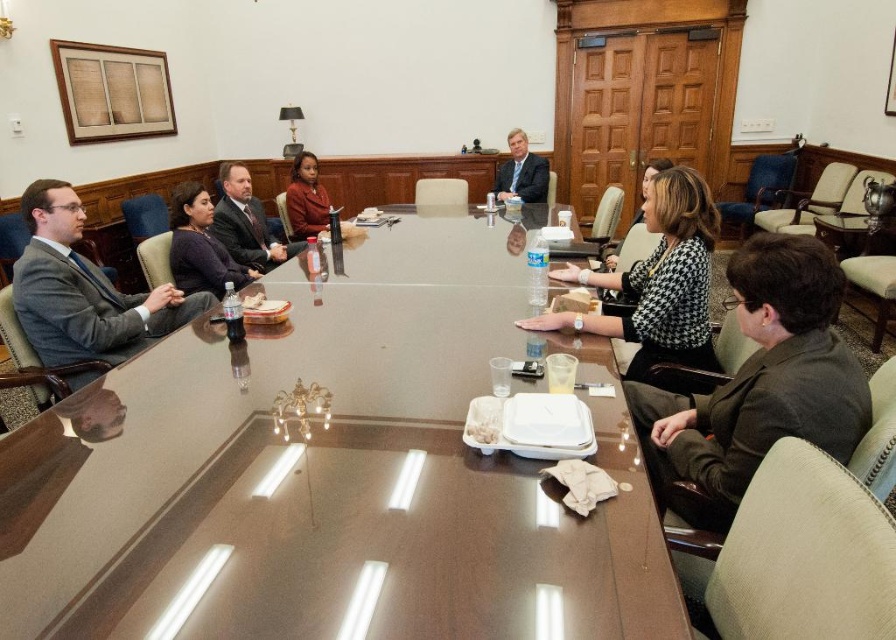
You are a photographer in the conference room. You need to capture a photo of the black houndstooth dress at center and the matte black suit at upper center. Which one will appear larger in the photo?

The black houndstooth dress at center is much taller than the matte black suit at upper center, so it will appear larger in the photo.

You are a photographer taking a picture of the conference table. You need to place a small decorative item exactly halfway between the point at coordinate point (145,323) and the point at coordinate point (306,188). Will this item be closer to the camera than both points?

The point halfway between point (145,323) and point (306,188) will be closer to the camera than both points because the original point (145,323) is already closer to the camera than the other point. Since the halfway point is between them, it would be closer to the camera than the farther point but not necessarily both. Wait, the description says point (145,323) is closer to the camera than point (306,188). The halfway point would be between them. Since one is closer and the other is farther,